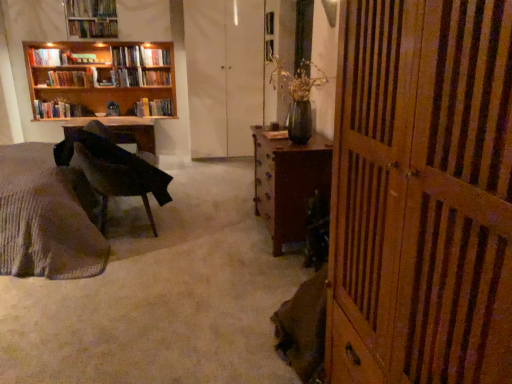
Find the location of a particular element. hardcover books at left, the 1th book positioned from the bottom is located at coordinates (60, 110).

Describe the element at coordinates (422, 194) in the screenshot. I see `wooden screen door at right, the second screen door positioned from the top` at that location.

What is the approximate width of knitted fabric bed at lower left?

knitted fabric bed at lower left is 1.48 meters wide.

Image resolution: width=512 pixels, height=384 pixels. Describe the element at coordinates (111, 178) in the screenshot. I see `velvet dark brown chair at left` at that location.

Locate an element on the screen. hardcover books at upper left, which is the first book in top-to-bottom order is located at coordinates (93, 28).

What is the approximate width of hardcover book at upper left, the sixth book ordered from the bottom?

hardcover book at upper left, the sixth book ordered from the bottom, is 7.46 inches in width.

I want to click on wooden bookshelf at upper left, so click(98, 81).

In the scene shown: From the image's perspective, would you say white matte screen door at center, positioned as the 2th screen door in front-to-back order, is shown under hardcover book at upper left, the sixth book ordered from the bottom?

Indeed, from the image's perspective, white matte screen door at center, positioned as the 2th screen door in front-to-back order, is shown beneath hardcover book at upper left, the sixth book ordered from the bottom.

Is point (234, 75) farther from viewer compared to point (143, 60)?

No, it is not.

From a real-world perspective, is white matte screen door at center, which ranks as the second screen door in right-to-left order, physically above hardcover book at upper left, positioned as the second book in top-to-bottom order?

No, from a real-world perspective, white matte screen door at center, which ranks as the second screen door in right-to-left order, is not above hardcover book at upper left, positioned as the second book in top-to-bottom order.

Consider the image. Is wooden screen door at right, which appears as the 1th screen door when viewed from the front, facing towards hardcover books at upper left, which is the first book in top-to-bottom order?

No.

Considering the positions of points (479, 19) and (100, 36), is point (479, 19) farther from camera compared to point (100, 36)?

No.

Is wooden screen door at right, the second screen door positioned from the top, further to camera compared to hardcover books at upper left, the seventh book positioned from the bottom?

No, it is in front of hardcover books at upper left, the seventh book positioned from the bottom.

Can we say wooden screen door at right, the second screen door positioned from the top, lies outside hardcover books at upper left, which is the first book in top-to-bottom order?

Yes, wooden screen door at right, the second screen door positioned from the top, is outside of hardcover books at upper left, which is the first book in top-to-bottom order.

How different are the orientations of white matte screen door at center, the 1th screen door from the left, and matte black table at left in degrees?

There is a 0.0863-degree angle between the facing directions of white matte screen door at center, the 1th screen door from the left, and matte black table at left.

Does point (214, 145) appear closer or farther from the camera than point (98, 134)?

Point (214, 145).

Could you measure the distance between white matte screen door at center, which ranks as the second screen door in right-to-left order, and matte black table at left?

white matte screen door at center, which ranks as the second screen door in right-to-left order, and matte black table at left are 1.18 meters apart.

From a real-world perspective, does white matte screen door at center, the 1th screen door from the left, sit lower than matte black table at left?

Incorrect, from a real-world perspective, white matte screen door at center, the 1th screen door from the left, is higher than matte black table at left.

From the image's perspective, which one is positioned higher, hardcover book at upper left, the fourth book ordered from the bottom, or hardcover book at upper left, which is counted as the fifth book, starting from the top?

hardcover book at upper left, the fourth book ordered from the bottom, from the image's perspective.

Can you confirm if hardcover book at upper left, the fourth book ordered from the bottom, is positioned to the left of hardcover book at upper left, acting as the 3th book starting from the bottom?

In fact, hardcover book at upper left, the fourth book ordered from the bottom, is to the right of hardcover book at upper left, acting as the 3th book starting from the bottom.

Considering the relative sizes of hardcover book at upper left, the fourth book ordered from the bottom, and hardcover book at upper left, acting as the 3th book starting from the bottom, in the image provided, is hardcover book at upper left, the fourth book ordered from the bottom, bigger than hardcover book at upper left, acting as the 3th book starting from the bottom,?

No.

How many degrees apart are the facing directions of hardcover book at upper left, the fourth book ordered from the bottom, and hardcover book at upper left, acting as the 3th book starting from the bottom?

The facing directions of hardcover book at upper left, the fourth book ordered from the bottom, and hardcover book at upper left, acting as the 3th book starting from the bottom, are 0.00618 degrees apart.

Find the location of `book that is the 2nd object located in front of the hardcover books at left, acting as the 2th book starting from the bottom`. book that is the 2nd object located in front of the hardcover books at left, acting as the 2th book starting from the bottom is located at coordinates (93, 28).

Between hardcover books at left, acting as the 2th book starting from the bottom, and hardcover books at upper left, which is the first book in top-to-bottom order, which one appears on the right side from the viewer's perspective?

hardcover books at upper left, which is the first book in top-to-bottom order.

Could you measure the distance between hardcover books at left, positioned as the sixth book in top-to-bottom order, and hardcover books at upper left, the seventh book positioned from the bottom?

Result: hardcover books at left, positioned as the sixth book in top-to-bottom order, is 24.40 inches away from hardcover books at upper left, the seventh book positioned from the bottom.

Is hardcover books at left, acting as the 2th book starting from the bottom, thinner than hardcover books at upper left, which is the first book in top-to-bottom order?

In fact, hardcover books at left, acting as the 2th book starting from the bottom, might be wider than hardcover books at upper left, which is the first book in top-to-bottom order.

Is white matte screen door at center, which ranks as the second screen door in right-to-left order, positioned with its back to wooden carved desk at center?

No, white matte screen door at center, which ranks as the second screen door in right-to-left order, is not facing away from wooden carved desk at center.

Is white matte screen door at center, which ranks as the first screen door in top-to-bottom order, with wooden carved desk at center?

No.

Which is behind, white matte screen door at center, positioned as the 2th screen door in front-to-back order, or wooden carved desk at center?

white matte screen door at center, positioned as the 2th screen door in front-to-back order, is further from the camera.

From a real-world perspective, is white matte screen door at center, which ranks as the first screen door in top-to-bottom order, located beneath wooden carved desk at center?

No.

Which of these two, hardcover books at left, acting as the 2th book starting from the bottom, or hardcover books at left, the 1th book positioned from the bottom, is thinner?

hardcover books at left, acting as the 2th book starting from the bottom.

In the scene shown: Is hardcover books at left, acting as the 2th book starting from the bottom, not near hardcover books at left, the 1th book positioned from the bottom?

hardcover books at left, acting as the 2th book starting from the bottom, is near hardcover books at left, the 1th book positioned from the bottom, not far away.

Considering the relative positions of hardcover books at left, positioned as the sixth book in top-to-bottom order, and hardcover books at left, the 1th book positioned from the bottom, in the image provided, is hardcover books at left, positioned as the sixth book in top-to-bottom order, behind hardcover books at left, the 1th book positioned from the bottom,?

No, hardcover books at left, positioned as the sixth book in top-to-bottom order, is closer to the viewer.

From the white matte screen door at center, which is the second screen door in bottom-to-top order, count 7th books backward and point to it. Please provide its 2D coordinates.

[(155, 57)]

The height and width of the screenshot is (384, 512). I want to click on the 2nd screen door below the hardcover books at upper left, the seventh book positioned from the bottom (from the image's perspective), so click(x=422, y=194).

When comparing their distances from hardcover books at left, acting as the 2th book starting from the bottom, does wooden bookshelf at upper left or hardcover book at upper center, the 5th book ordered from the bottom, seem closer?

The object closer to hardcover books at left, acting as the 2th book starting from the bottom, is wooden bookshelf at upper left.

Looking at the image, which one is located further to hardcover book at upper center, the 5th book ordered from the bottom, hardcover book at upper left, which is counted as the fifth book, starting from the top, or velvet dark brown chair at left?

velvet dark brown chair at left is further to hardcover book at upper center, the 5th book ordered from the bottom.

Considering their positions, is hardcover books at left, acting as the seventh book starting from the top, positioned further to hardcover book at upper left, which is counted as the fifth book, starting from the top, than hardcover book at upper center, which is the 3th book in top-to-bottom order?

Based on the image, hardcover book at upper center, which is the 3th book in top-to-bottom order, appears to be further to hardcover book at upper left, which is counted as the fifth book, starting from the top.

From the image, which object appears to be farther from velvet dark brown chair at left, matte black table at left or hardcover book at upper left, which is counted as the fifth book, starting from the top?

The object further to velvet dark brown chair at left is hardcover book at upper left, which is counted as the fifth book, starting from the top.

When comparing their distances from hardcover books at left, the 1th book positioned from the bottom, does hardcover book at upper left, which ranks as the 4th book in top-to-bottom order, or hardcover book at upper left, positioned as the second book in top-to-bottom order, seem further?

hardcover book at upper left, positioned as the second book in top-to-bottom order.

Based on their spatial positions, is velvet dark brown chair at left or hardcover book at upper left, positioned as the second book in top-to-bottom order, closer to wooden screen door at right, marked as the 1th screen door in a bottom-to-top arrangement?

velvet dark brown chair at left is closer to wooden screen door at right, marked as the 1th screen door in a bottom-to-top arrangement.

Based on their spatial positions, is hardcover book at upper left, which ranks as the 4th book in top-to-bottom order, or hardcover book at upper left, positioned as the second book in top-to-bottom order, closer to matte black table at left?

Among the two, hardcover book at upper left, positioned as the second book in top-to-bottom order, is located nearer to matte black table at left.

Considering their positions, is hardcover book at upper left, the sixth book ordered from the bottom, positioned further to wooden screen door at right, marked as the 1th screen door in a right-to-left arrangement, than knitted fabric bed at lower left?

Among the two, hardcover book at upper left, the sixth book ordered from the bottom, is located further to wooden screen door at right, marked as the 1th screen door in a right-to-left arrangement.

Identify the location of screen door between knitted fabric bed at lower left and hardcover books at left, acting as the seventh book starting from the top, from front to back. Image resolution: width=512 pixels, height=384 pixels. (224, 74).

Find the location of `screen door positioned between velvet dark brown chair at left and matte black table at left from near to far`. screen door positioned between velvet dark brown chair at left and matte black table at left from near to far is located at coordinates (224, 74).

At what (x,y) coordinates should I click in order to perform the action: click on screen door located between wooden carved desk at center and wooden bookshelf at upper left in the depth direction. Please return your answer as a coordinate pair (x, y). The height and width of the screenshot is (384, 512). Looking at the image, I should click on (224, 74).

Where is `bookcase between wooden carved desk at center and hardcover book at upper center, which is the 3th book in top-to-bottom order, along the z-axis`? The width and height of the screenshot is (512, 384). bookcase between wooden carved desk at center and hardcover book at upper center, which is the 3th book in top-to-bottom order, along the z-axis is located at coordinates (98, 81).